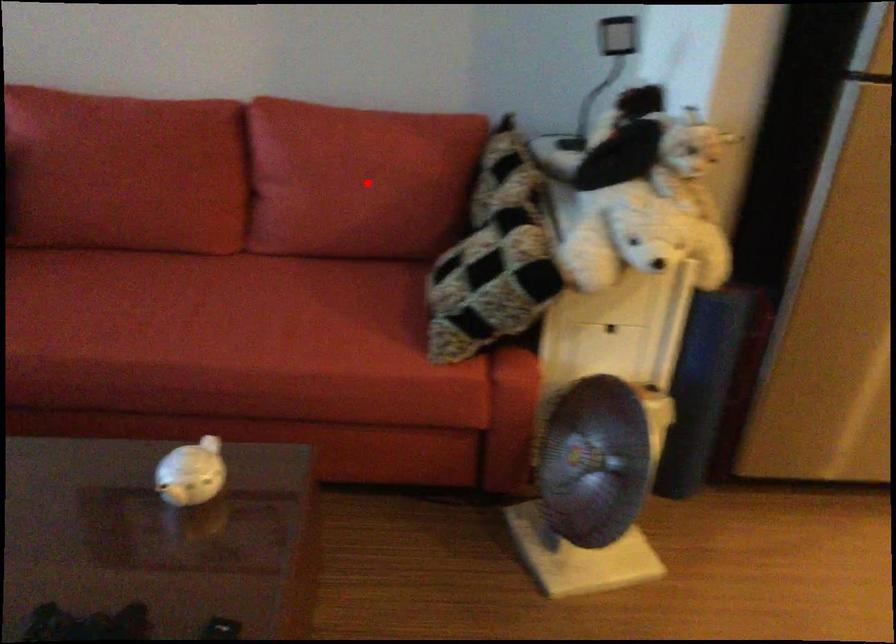
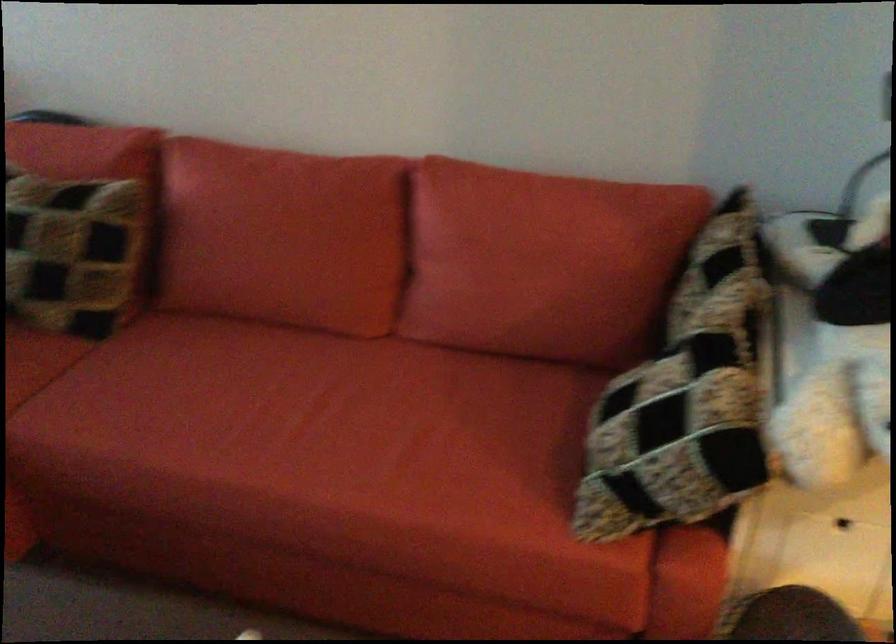
Question: I am providing you with two images of the same scene from different viewpoints. A red point is shown in image1. For the corresponding object point in image2, is it positioned nearer or farther from the camera?

Choices:
 (A) Nearer
 (B) Farther

Answer: (A)